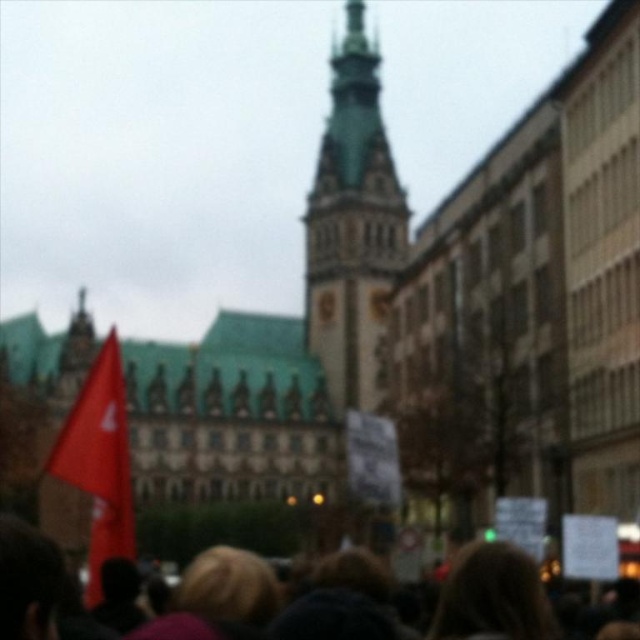
You are a photographer trying to capture a clear photo of the matte red flag at left and the blurred hair at lower center. You need to ensure both are in focus. Given that your camera can only focus on objects within a 10 meter range, will you be able to get both in focus?

The matte red flag at left and blurred hair at lower center are 15.96 meters apart from each other. Since the camera can only focus on objects within a 10 meter range, the distance between them exceeds this limit, making it impossible to have both in focus simultaneously.